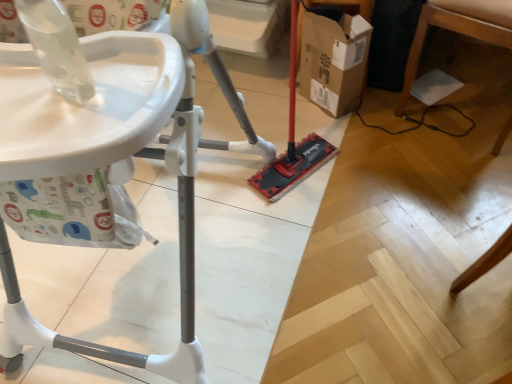
The width and height of the screenshot is (512, 384). I want to click on vacant region in front of wooden table leg at lower right, the 1th furniture positioned from the right, so click(x=444, y=192).